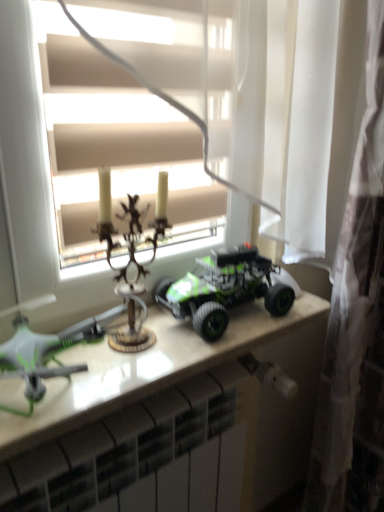
Question: Is white glossy radiator at lower center closer to the viewer compared to matte white window at center?

Choices:
 (A) no
 (B) yes

Answer: (A)

Question: Is white glossy radiator at lower center thinner than matte white window at center?

Choices:
 (A) no
 (B) yes

Answer: (A)

Question: From a real-world perspective, is white glossy radiator at lower center positioned over matte white window at center based on gravity?

Choices:
 (A) no
 (B) yes

Answer: (A)

Question: From a real-world perspective, is white glossy radiator at lower center located beneath matte white window at center?

Choices:
 (A) yes
 (B) no

Answer: (A)

Question: Are white glossy radiator at lower center and matte white window at center making contact?

Choices:
 (A) yes
 (B) no

Answer: (B)

Question: Is white glossy radiator at lower center facing away from matte white window at center?

Choices:
 (A) no
 (B) yes

Answer: (A)

Question: Is antique brass candlestick at center, marked as the 2th toy in a left-to-right arrangement, taller than white glossy radiator at lower center?

Choices:
 (A) yes
 (B) no

Answer: (B)

Question: Can you confirm if antique brass candlestick at center, which appears as the second toy when viewed from the right, is bigger than white glossy radiator at lower center?

Choices:
 (A) yes
 (B) no

Answer: (B)

Question: Considering the relative positions of antique brass candlestick at center, which appears as the second toy when viewed from the right, and white glossy radiator at lower center in the image provided, is antique brass candlestick at center, which appears as the second toy when viewed from the right, in front of white glossy radiator at lower center?

Choices:
 (A) yes
 (B) no

Answer: (B)

Question: Considering the relative positions of antique brass candlestick at center, marked as the 2th toy in a left-to-right arrangement, and white glossy radiator at lower center in the image provided, is antique brass candlestick at center, marked as the 2th toy in a left-to-right arrangement, to the left of white glossy radiator at lower center from the viewer's perspective?

Choices:
 (A) yes
 (B) no

Answer: (A)

Question: Would you say white glossy radiator at lower center is part of antique brass candlestick at center, which appears as the second toy when viewed from the right,'s contents?

Choices:
 (A) no
 (B) yes

Answer: (A)

Question: From a real-world perspective, is antique brass candlestick at center, which appears as the second toy when viewed from the right, below white glossy radiator at lower center?

Choices:
 (A) no
 (B) yes

Answer: (A)

Question: From a real-world perspective, does green matte drone at left, which ranks as the third toy in right-to-left order, stand above white glossy table at center?

Choices:
 (A) no
 (B) yes

Answer: (B)